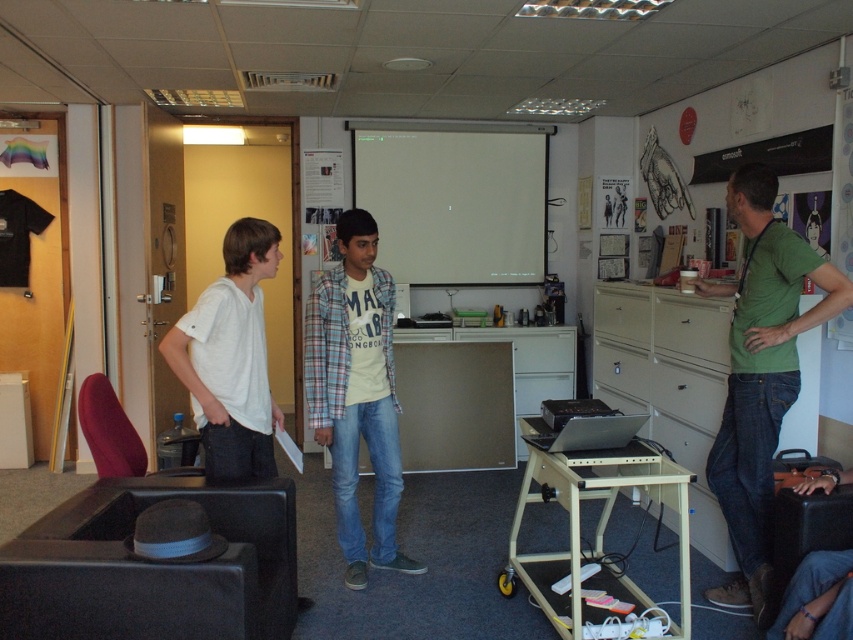
You are standing in the office and need to locate the plaid cotton shirt at center. Based on the coordinates provided, where exactly would you find it?

The plaid cotton shirt at center is located at coordinates point (357, 394).

You are a delivery robot with a width of 1 meter. You need to move through the space between the green cotton shirt at right and the plaid cotton shirt at center. Can you fit through the space without touching them?

The distance between the green cotton shirt at right and the plaid cotton shirt at center is 1.52 meters. Since the robot is 1 meter wide, it can fit through the space as the distance is greater than the robot width.

You are organizing a clothing donation drive and need to categorize shirts by their thickness. You have two shirts to assess in the image provided. Which of the two shirts, the green cotton shirt at right or the plaid cotton shirt at center, is thinner?

The green cotton shirt at right is thinner than the plaid cotton shirt at center according to the description.